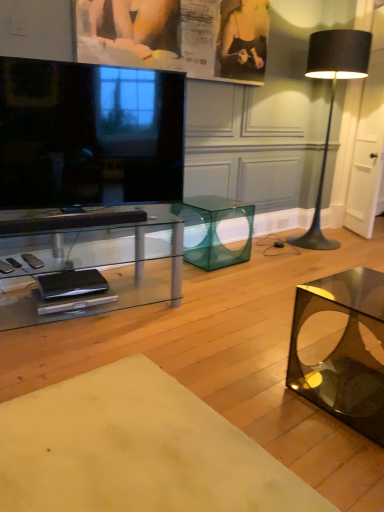
Question: From the image's perspective, is black glossy television at left located above or below black matte floor lamp at right?

Choices:
 (A) above
 (B) below

Answer: (B)

Question: Looking at the image, does black glossy television at left seem bigger or smaller compared to black matte floor lamp at right?

Choices:
 (A) big
 (B) small

Answer: (B)

Question: Which is farther from the polished black glass cube at lower right?

Choices:
 (A) transparent glass cube at center, which is the first table from back to front
 (B) clear glass table at center, which is the 2th table from back to front
 (C) smooth cream fabric at lower center, acting as the 3th table starting from the back
 (D) black matte floor lamp at right
 (E) matte paper poster at upper center

Answer: (D)

Question: Based on their relative distances, which object is farther from the polished black glass cube at lower right?

Choices:
 (A) matte paper poster at upper center
 (B) smooth cream fabric at lower center, acting as the 3th table starting from the back
 (C) clear glass table at center, the second table positioned from the front
 (D) black matte floor lamp at right
 (E) black glossy television at left

Answer: (D)